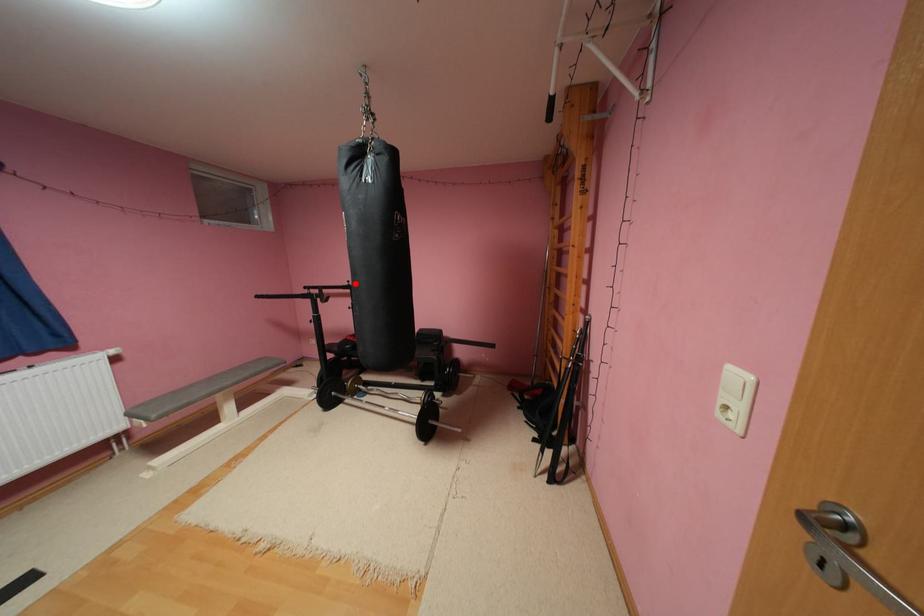
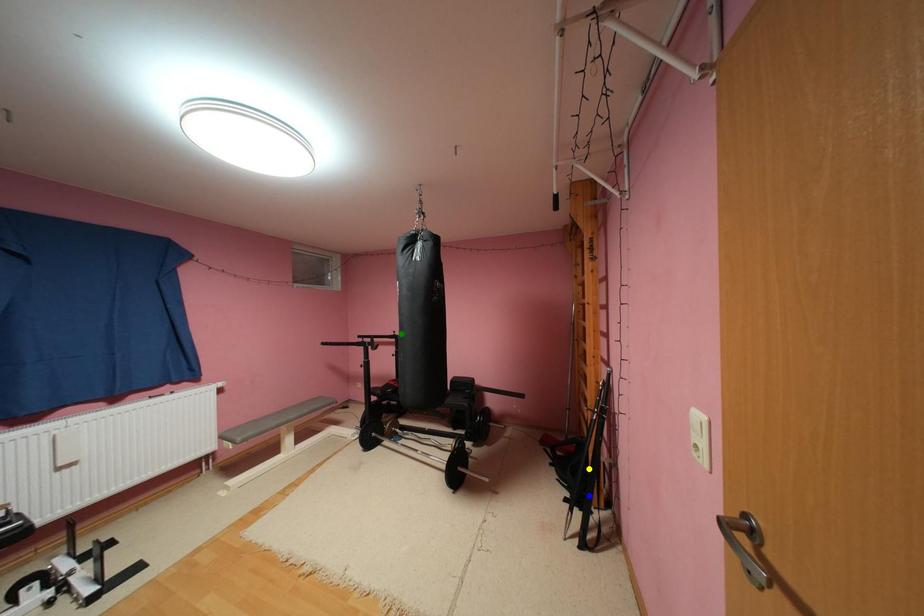
Question: I am providing you with two images of the same scene from different viewpoints. A red point is marked on the first image. You are given multiple points on the second image. In image 2, which mark is for the same physical point as the one in image 1?

Choices:
 (A) yellow point
 (B) blue point
 (C) green point

Answer: (C)